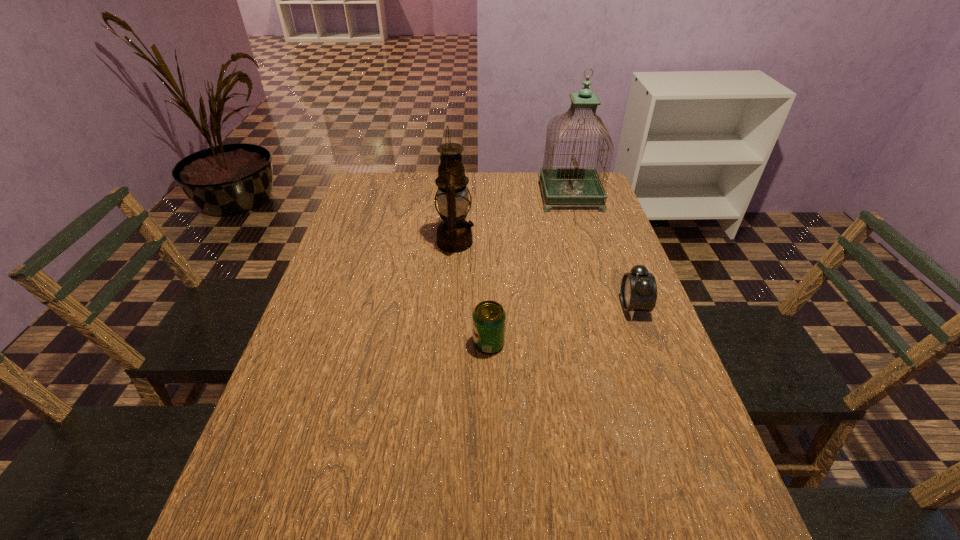
I want to click on free spot located on the right of the oil lamp, so click(503, 242).

Find the location of a particular element. The image size is (960, 540). free location located 0.090m on the front side of the alarm clock is located at coordinates (586, 307).

This screenshot has width=960, height=540. In order to click on vacant space situated on the front side of the alarm clock in this screenshot , I will do `click(482, 307)`.

Identify the location of vacant space located 0.260m on the front side of the alarm clock. The width and height of the screenshot is (960, 540). (520, 307).

Identify the location of vacant space situated 0.150m on the left of the second object from left to right. (410, 343).

This screenshot has width=960, height=540. I want to click on object positioned at the far edge, so click(563, 186).

At what (x,y) coordinates should I click in order to perform the action: click on birdcage located at the right edge. Please return your answer as a coordinate pair (x, y). Looking at the image, I should click on (563, 186).

Image resolution: width=960 pixels, height=540 pixels. In order to click on alarm clock present at the right edge in this screenshot , I will do `click(638, 292)`.

What are the coordinates of `object present at the far right corner` in the screenshot? It's located at (563, 186).

The image size is (960, 540). What are the coordinates of `vacant space at the far edge of the desktop` in the screenshot? It's located at (487, 196).